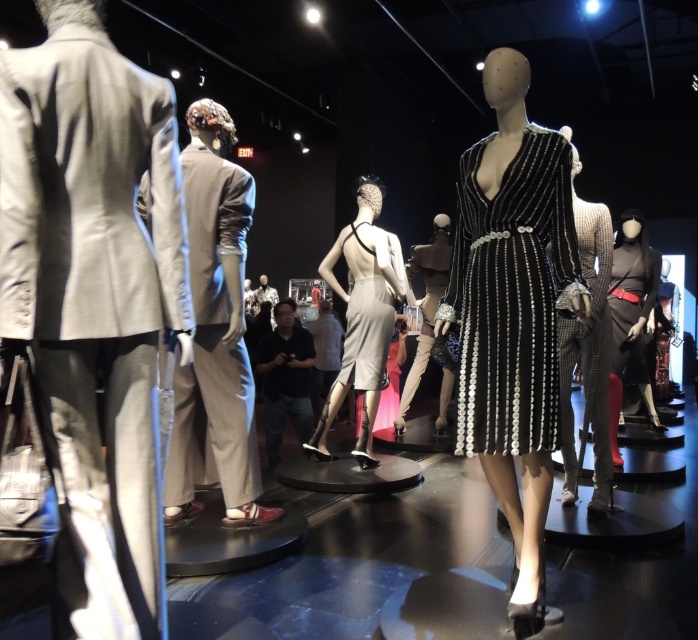
You are a photographer standing at the camera position. You want to take a closeup shot of the matte black dress at right without moving the camera. Is it possible to do so given the distance?

The matte black dress at right is 11.42 feet away from camera, so it is possible to take a closeup shot without moving the camera if the lens has sufficient zoom capability.

You are a fashion designer who wants to place a new accessory between the matte gray suit at left and the satin silver clutch at center. Based on their sizes, which object should the accessory be closer to?

The matte gray suit at left has a smaller size compared to the satin silver clutch at center, so the accessory should be placed closer to the satin silver clutch at center to balance the sizes.